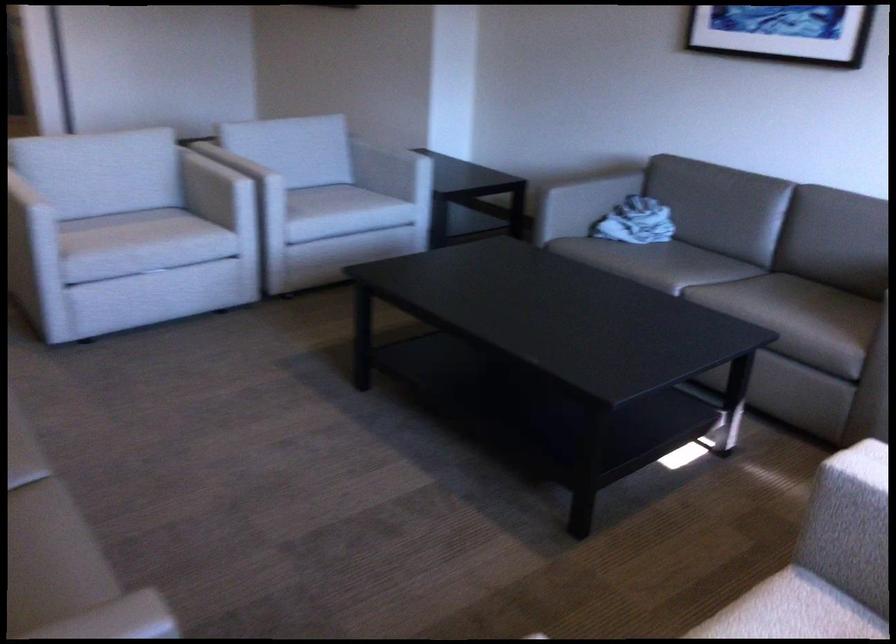
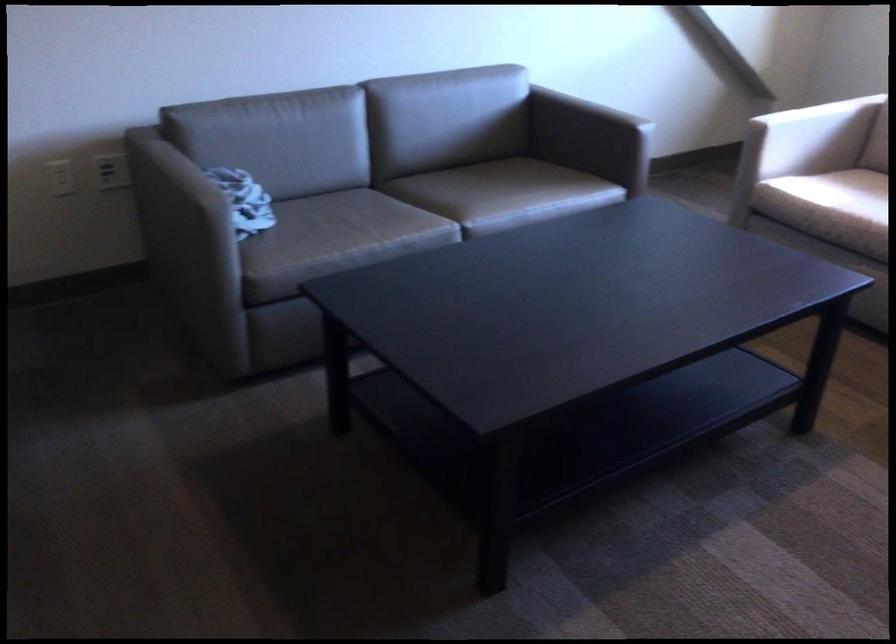
The point at (748, 298) is marked in the first image. Where is the corresponding point in the second image?

(489, 194)